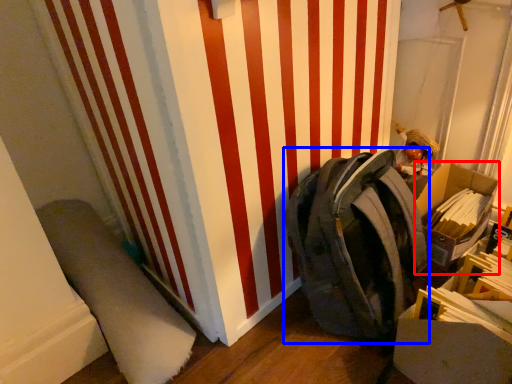
Question: Among these objects, which one is nearest to the camera, cardboard box (highlighted by a red box) or backpack (highlighted by a blue box)?

Choices:
 (A) cardboard box
 (B) backpack

Answer: (B)